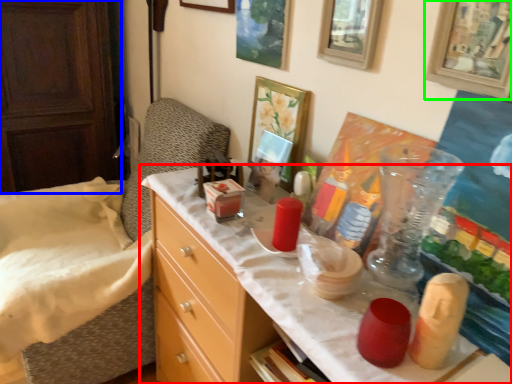
Question: Based on their relative distances, which object is farther from desk (highlighted by a red box)? Choose from dresser (highlighted by a blue box) and picture frame (highlighted by a green box).

Choices:
 (A) dresser
 (B) picture frame

Answer: (A)